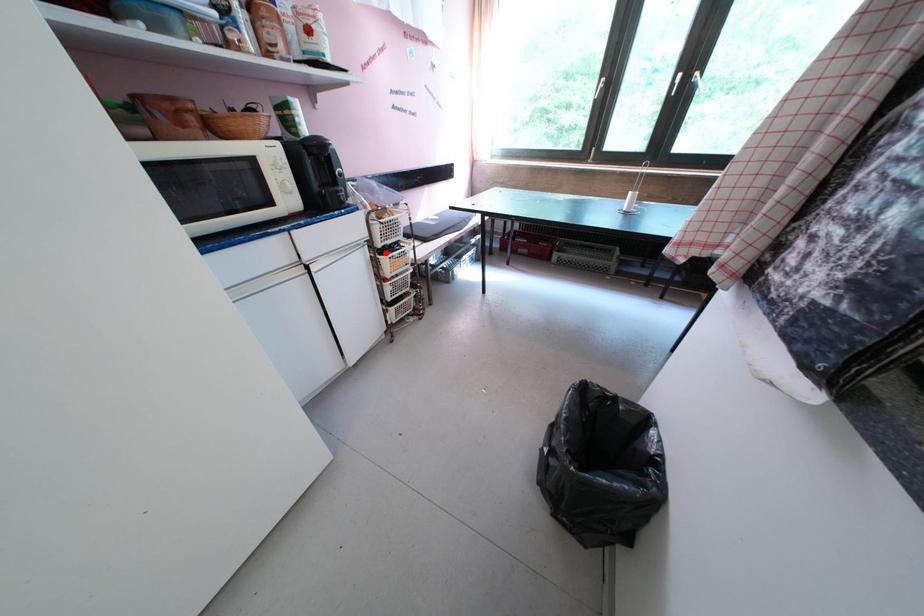
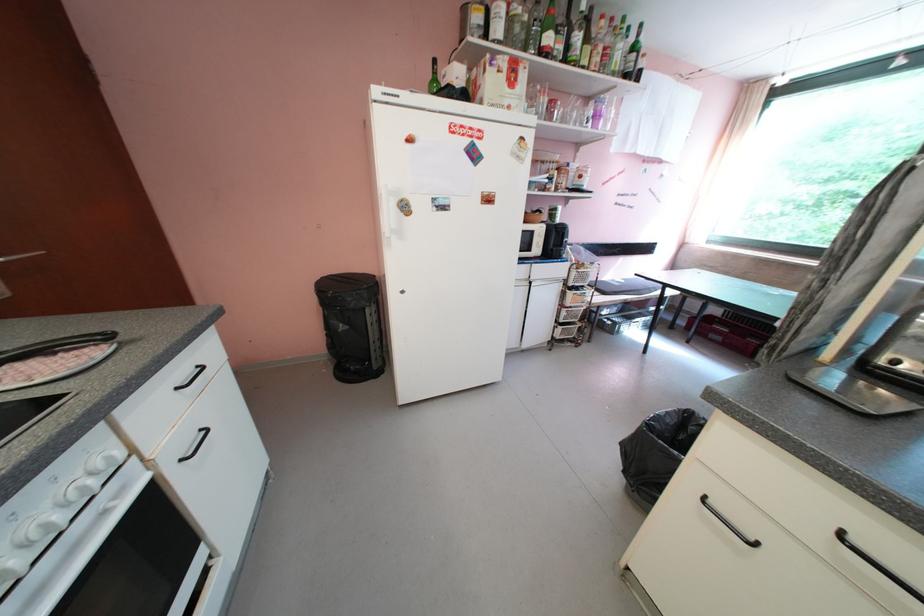
The point at the highlighted location is marked in the first image. Where is the corresponding point in the second image?

(576, 290)